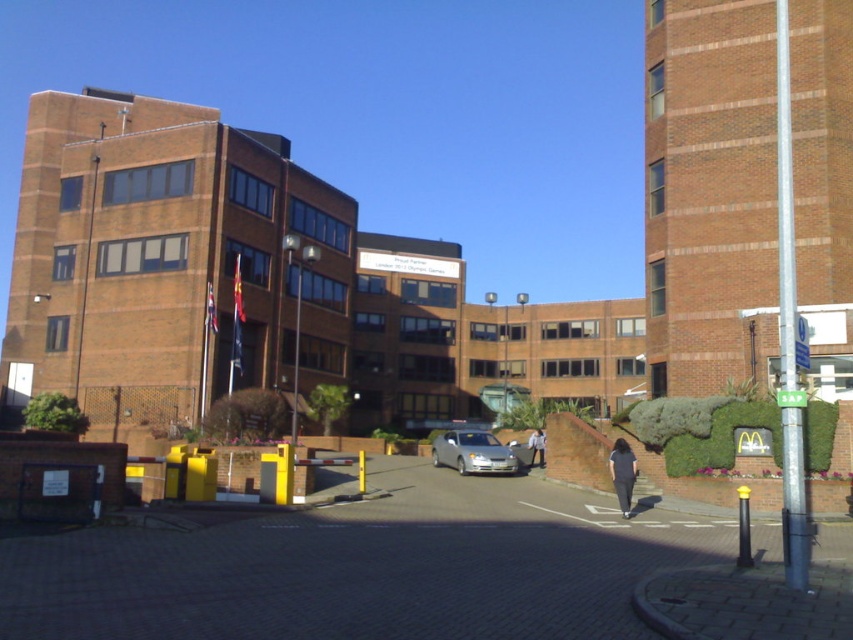
You are a delivery person standing at the entrance of the building complex. You need to deliver a package to the person wearing the dark gray fabric pants at lower center and the light blue denim jacket at center. The delivery robot you have can only travel 40 feet before needing a recharge. Can the robot deliver the package to both people without needing to recharge?

The dark gray fabric pants at lower center is 41.72 feet from the light blue denim jacket at center. Since the distance between them is greater than the robot can travel without recharging, the robot cannot deliver the package to both people without needing to recharge.

You are a delivery person trying to park your van next to the silver metallic car at center and the light blue denim jacket at center. Since the van is 2 meters wide, can you fit it between them without moving either object?

The silver metallic car at center is larger than the light blue denim jacket at center, but the exact distance between them isn

You are a delivery person trying to park your 1.8 meters tall delivery box in the parking lot. You see the silver metallic car at center and the light brown leather jacket at center. Which object is taller and can the delivery box fit between them vertically?

The silver metallic car at center is much taller than the light brown leather jacket at center. Since the delivery box is 1.8 meters tall, it can fit between them vertically as the car is taller than the jacket, creating enough space.